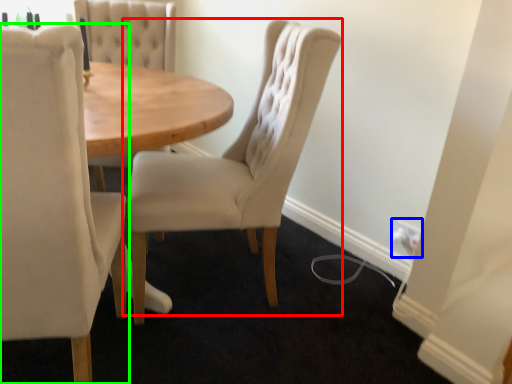
Question: Which object is the closest to the chair (highlighted by a red box)? Choose among these: electric outlet (highlighted by a blue box) or chair (highlighted by a green box).

Choices:
 (A) electric outlet
 (B) chair

Answer: (B)